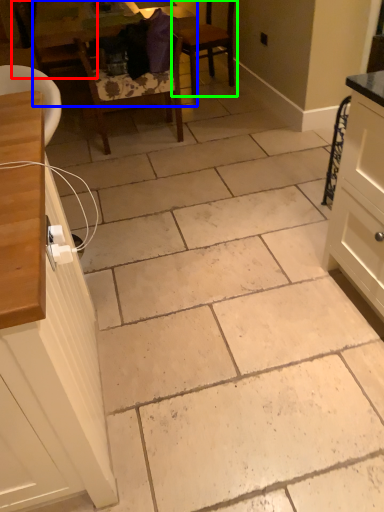
Question: Which object is the closest to the chair (highlighted by a red box)? Choose among these: table (highlighted by a blue box) or chair (highlighted by a green box).

Choices:
 (A) table
 (B) chair

Answer: (A)